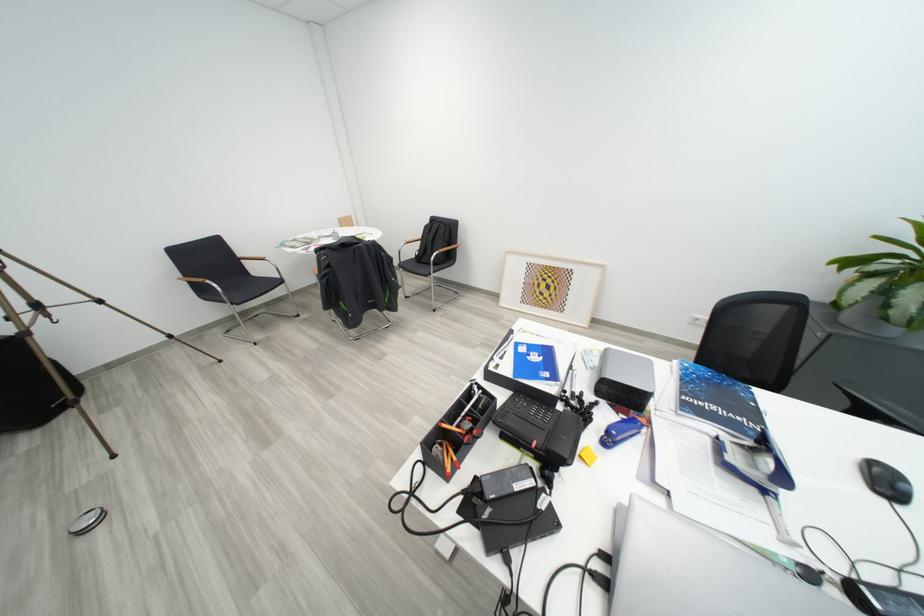
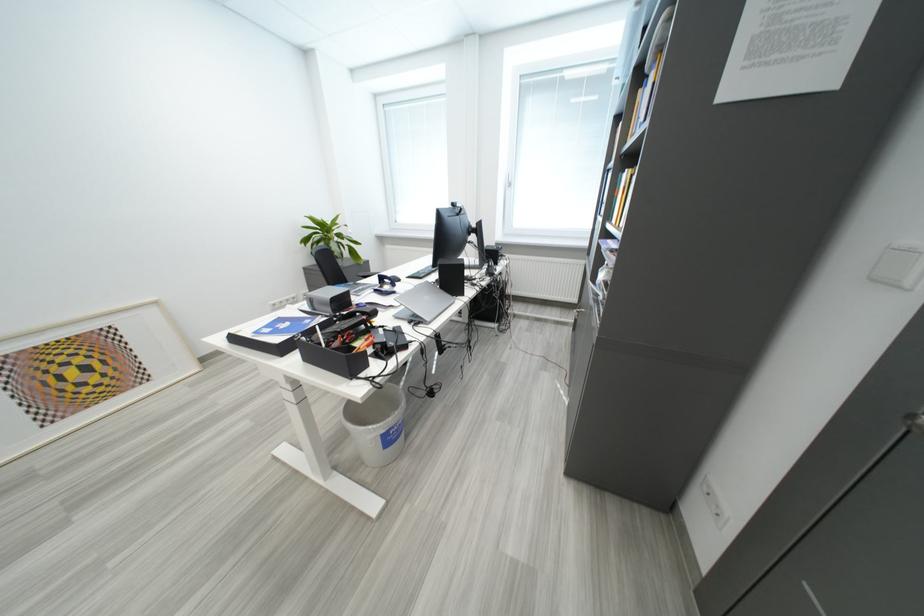
In the second image, find the point that corresponds to point (557, 283) in the first image.

(88, 363)